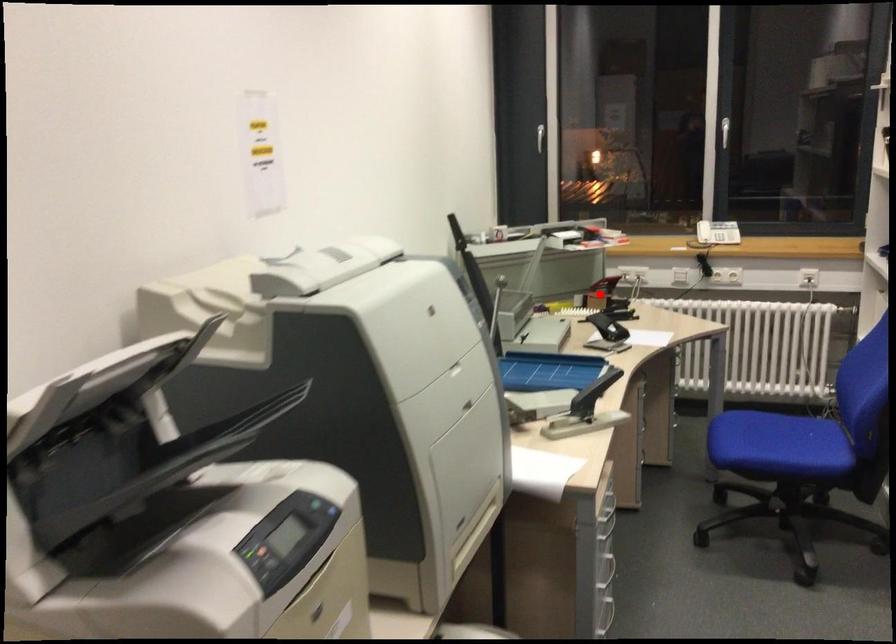
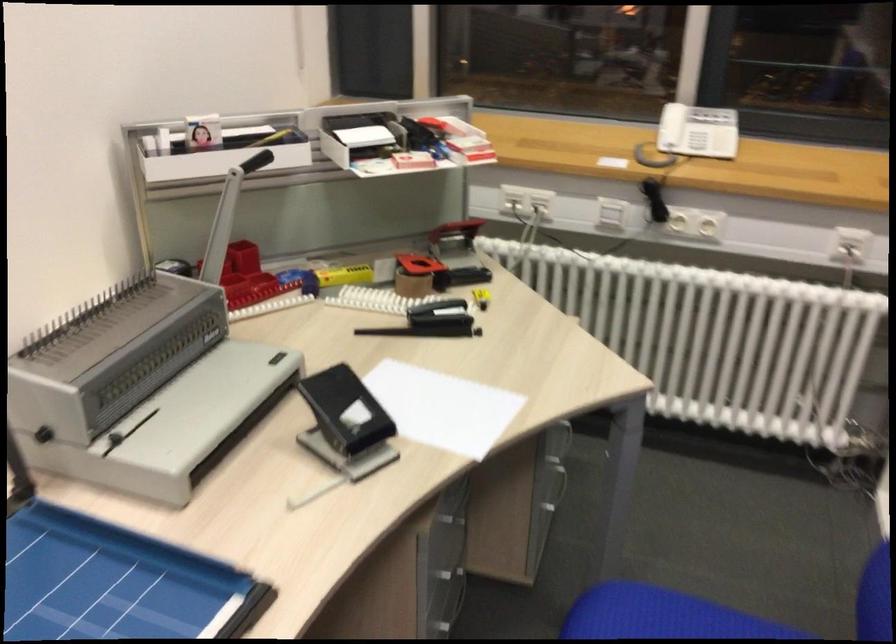
Question: I am providing you with two images of the same scene from different viewpoints. In image1, a red point is highlighted. Considering the same 3D point in image2, which of the following is correct?

Choices:
 (A) It is closer
 (B) It is farther

Answer: (A)